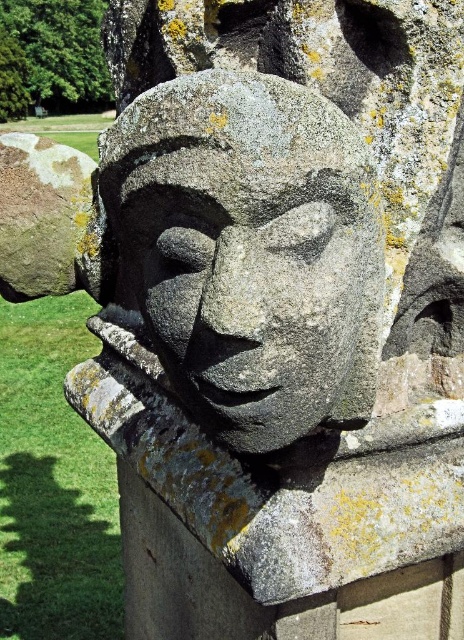
Does gray stone face at center have a larger size compared to speckled gray rock at upper left?

Yes, gray stone face at center is bigger than speckled gray rock at upper left.

Measure the distance between point (330,196) and camera.

Point (330,196) and camera are 1.04 meters apart from each other.

At what (x,y) coordinates should I click in order to perform the action: click on gray stone face at center. Please return your answer as a coordinate pair (x, y). This screenshot has height=640, width=464. Looking at the image, I should click on (250, 252).